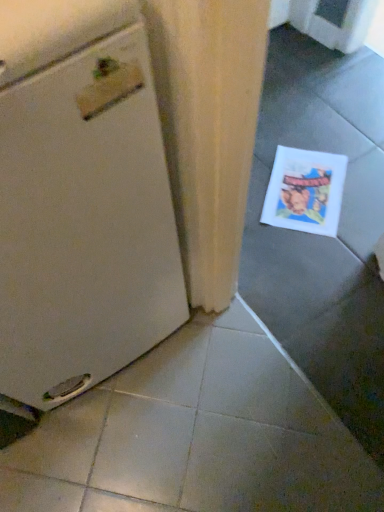
Locate an element on the screen. white paper comic book at lower right is located at coordinates (305, 191).

This screenshot has width=384, height=512. Describe the element at coordinates (305, 191) in the screenshot. I see `white paper comic book at lower right` at that location.

At what (x,y) coordinates should I click in order to perform the action: click on white matte refrigerator at left. Please return your answer as a coordinate pair (x, y). This screenshot has width=384, height=512. Looking at the image, I should click on (81, 199).

Measure the distance between point (60,340) and camera.

A distance of 72.70 centimeters exists between point (60,340) and camera.

The width and height of the screenshot is (384, 512). Describe the element at coordinates (81, 199) in the screenshot. I see `white matte refrigerator at left` at that location.

I want to click on white paper comic book at lower right, so click(305, 191).

Visually, is white matte refrigerator at left positioned to the left or to the right of white paper comic book at lower right?

In the image, white matte refrigerator at left appears on the left side of white paper comic book at lower right.

Relative to white paper comic book at lower right, is white matte refrigerator at left in front or behind?

white matte refrigerator at left is in front of white paper comic book at lower right.

Does point (142, 218) come closer to viewer compared to point (323, 211)?

Yes, it is.

Based on the photo, from the image's perspective, who appears lower, white matte refrigerator at left or white paper comic book at lower right?

white matte refrigerator at left is shown below in the image.

From a real-world perspective, does white matte refrigerator at left stand above white paper comic book at lower right?

Indeed, from a real-world perspective, white matte refrigerator at left stands above white paper comic book at lower right.

Considering the sizes of objects white matte refrigerator at left and white paper comic book at lower right in the image provided, who is thinner, white matte refrigerator at left or white paper comic book at lower right?

Thinner between the two is white paper comic book at lower right.

Considering the relative sizes of white matte refrigerator at left and white paper comic book at lower right in the image provided, is white matte refrigerator at left shorter than white paper comic book at lower right?

No, white matte refrigerator at left is not shorter than white paper comic book at lower right.

Is white matte refrigerator at left bigger or smaller than white paper comic book at lower right?

Considering their sizes, white matte refrigerator at left takes up more space than white paper comic book at lower right.

Is white paper comic book at lower right inside white matte refrigerator at left?

Definitely not — white paper comic book at lower right is not inside white matte refrigerator at left.

Is white matte refrigerator at left far from white paper comic book at lower right?

white matte refrigerator at left is actually quite close to white paper comic book at lower right.

Is white matte refrigerator at left turned away from white paper comic book at lower right?

white matte refrigerator at left does not have its back to white paper comic book at lower right.

Can you tell me how much white matte refrigerator at left and white paper comic book at lower right differ in facing direction?

The facing directions of white matte refrigerator at left and white paper comic book at lower right are 48 degrees apart.

You are a GUI agent. You are given a task and a screenshot of the screen. Output one action in this format:
    pyautogui.click(x=<x>, y=<y>)
    Task: Click on the home appliance in front of the white paper comic book at lower right
    
    Given the screenshot: What is the action you would take?
    pyautogui.click(x=81, y=199)

Which is more to the left, white paper comic book at lower right or white matte refrigerator at left?

Positioned to the left is white matte refrigerator at left.

Is the depth of white paper comic book at lower right less than that of white matte refrigerator at left?

No, the depth of white paper comic book at lower right is greater than that of white matte refrigerator at left.

Which point is more distant from viewer, (314, 211) or (59, 112)?

The point (314, 211) is farther.

From the image's perspective, which one is positioned lower, white paper comic book at lower right or white matte refrigerator at left?

white matte refrigerator at left.

From a real-world perspective, which is physically below, white paper comic book at lower right or white matte refrigerator at left?

white paper comic book at lower right, from a real-world perspective.

Looking at their sizes, would you say white paper comic book at lower right is wider or thinner than white matte refrigerator at left?

white paper comic book at lower right is thinner than white matte refrigerator at left.

In terms of height, does white paper comic book at lower right look taller or shorter compared to white matte refrigerator at left?

white paper comic book at lower right is shorter than white matte refrigerator at left.

Considering the sizes of objects white paper comic book at lower right and white matte refrigerator at left in the image provided, who is bigger, white paper comic book at lower right or white matte refrigerator at left?

Bigger between the two is white matte refrigerator at left.

Would you say white paper comic book at lower right is inside or outside white matte refrigerator at left?

white paper comic book at lower right lies outside white matte refrigerator at left.

Is white paper comic book at lower right placed right next to white matte refrigerator at left?

white paper comic book at lower right is not next to white matte refrigerator at left, and they're not touching.

Is white paper comic book at lower right oriented towards white matte refrigerator at left?

No, white paper comic book at lower right is not aimed at white matte refrigerator at left.

Measure the distance between white paper comic book at lower right and white matte refrigerator at left.

white paper comic book at lower right and white matte refrigerator at left are 27.31 inches apart from each other.

Identify the location of home appliance that is in front of the white paper comic book at lower right. (81, 199).

At what (x,y) coordinates should I click in order to perform the action: click on comic book above the white matte refrigerator at left (from the image's perspective). Please return your answer as a coordinate pair (x, y). Looking at the image, I should click on (305, 191).

The height and width of the screenshot is (512, 384). Find the location of `comic book behind the white matte refrigerator at left`. comic book behind the white matte refrigerator at left is located at coordinates (305, 191).